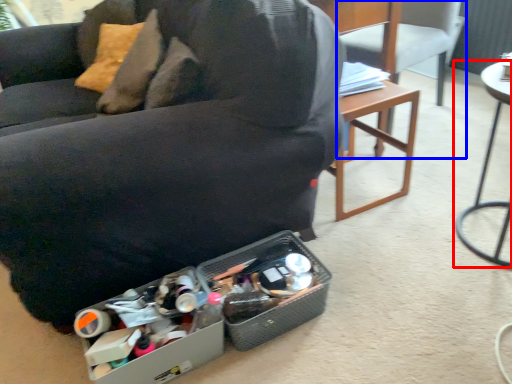
Question: Among these objects, which one is nearest to the camera, table (highlighted by a red box) or chair (highlighted by a blue box)?

Choices:
 (A) table
 (B) chair

Answer: (A)